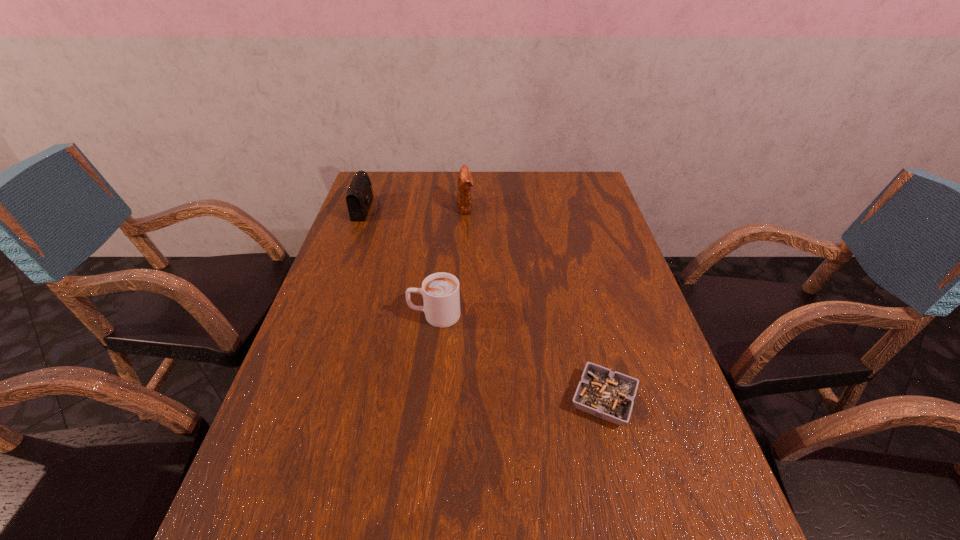
This screenshot has width=960, height=540. I want to click on vacant point located between the shortest object and the shorter clutch bag, so click(485, 304).

The image size is (960, 540). What are the coordinates of `free spot between the ashtray and the cappuccino` in the screenshot? It's located at (519, 357).

Locate an element on the screen. empty space that is in between the shorter clutch bag and the second nearest object is located at coordinates (400, 262).

Where is `vacant space that is in between the cappuccino and the leftmost object`? The height and width of the screenshot is (540, 960). vacant space that is in between the cappuccino and the leftmost object is located at coordinates (400, 262).

Where is `vacant space that is in between the ashtray and the right clutch bag`? The height and width of the screenshot is (540, 960). vacant space that is in between the ashtray and the right clutch bag is located at coordinates (535, 303).

Image resolution: width=960 pixels, height=540 pixels. I want to click on empty space that is in between the right clutch bag and the third farthest object, so click(450, 261).

This screenshot has width=960, height=540. Identify the location of free space between the left clutch bag and the second nearest object. (400, 262).

The image size is (960, 540). I want to click on vacant region between the tallest object and the cappuccino, so click(450, 261).

Find the location of a particular element. The height and width of the screenshot is (540, 960). vacant space that is in between the ashtray and the leftmost object is located at coordinates (485, 304).

In order to click on vacant area that lies between the leftmost object and the ashtray in this screenshot , I will do `click(485, 304)`.